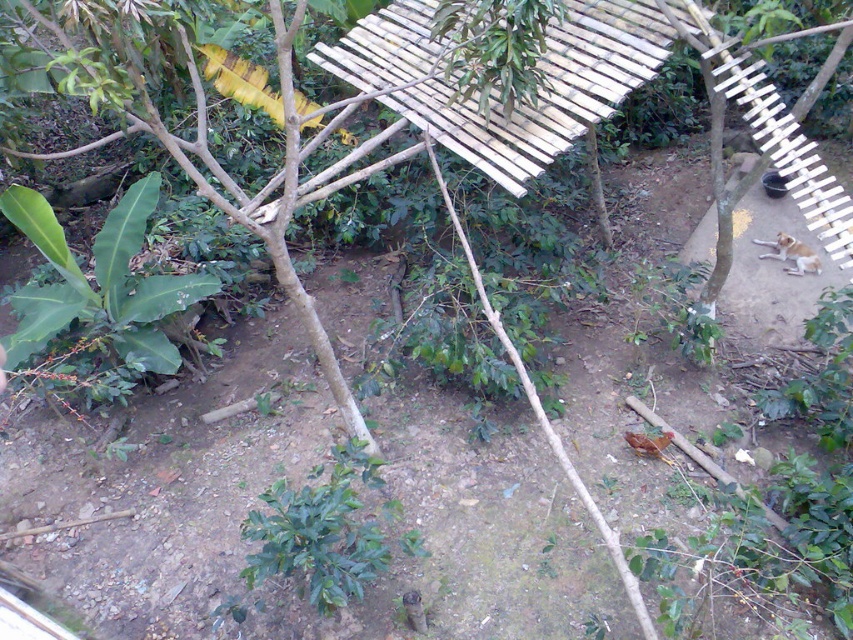
Question: Does wooden slats at center appear on the right side of green leafy plant at lower left?

Choices:
 (A) no
 (B) yes

Answer: (B)

Question: Which of the following is the farthest from the observer?

Choices:
 (A) (129, 243)
 (B) (337, 484)

Answer: (A)

Question: Observing the image, what is the correct spatial positioning of wooden slats at center in reference to green leafy plant at center?

Choices:
 (A) below
 (B) above

Answer: (B)

Question: Which object appears closest to the camera in this image?

Choices:
 (A) green leafy plant at center
 (B) green leafy plant at lower left
 (C) wooden slats at center

Answer: (A)

Question: Is green leafy plant at lower left smaller than green leafy plant at center?

Choices:
 (A) no
 (B) yes

Answer: (A)

Question: Which point is closer to the camera?

Choices:
 (A) (590, 22)
 (B) (125, 282)

Answer: (A)